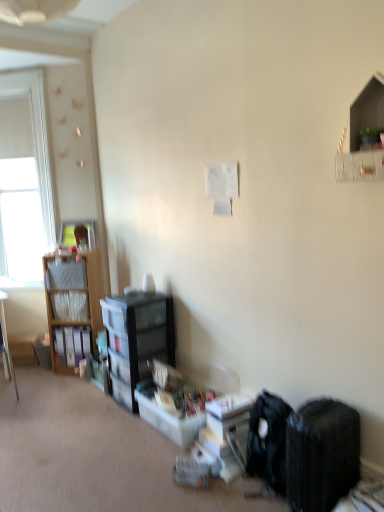
Question: Looking at the image, does white matte window screen at left seem bigger or smaller compared to black fabric backpack at lower right?

Choices:
 (A) small
 (B) big

Answer: (B)

Question: Is white matte window screen at left wider or thinner than black fabric backpack at lower right?

Choices:
 (A) wide
 (B) thin

Answer: (B)

Question: Considering the real-world distances, which object is closest to the white glossy shelf at upper right, which ranks as the first shelf in front-to-back order?

Choices:
 (A) black plastic bookcase at center-left
 (B) matte wooden picture frame at upper left
 (C) matte plastic shelf at left, which is counted as the first shelf, starting from the left
 (D) translucent plastic storage box at lower center
 (E) white matte window screen at left

Answer: (D)

Question: Based on their relative distances, which object is farther from the matte wood desk at left?

Choices:
 (A) translucent plastic storage box at lower center
 (B) matte wooden picture frame at upper left
 (C) matte plastic shelf at left, the second shelf viewed from the front
 (D) white matte window screen at left
 (E) black fabric backpack at lower right

Answer: (E)